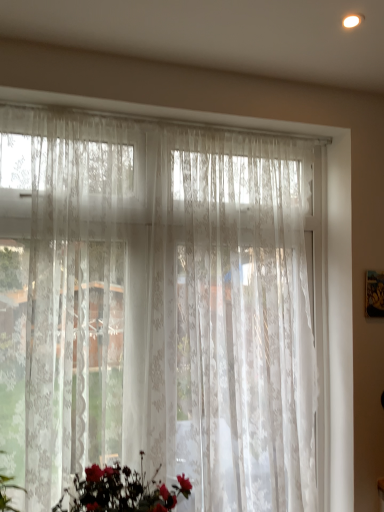
Question: From the image's perspective, is translucent floral-patterned curtain at center above or below silky white bouquet at lower center?

Choices:
 (A) below
 (B) above

Answer: (B)

Question: In terms of width, does translucent floral-patterned curtain at center look wider or thinner when compared to silky white bouquet at lower center?

Choices:
 (A) wide
 (B) thin

Answer: (B)

Question: Considering their positions, is translucent floral-patterned curtain at center located in front of or behind silky white bouquet at lower center?

Choices:
 (A) front
 (B) behind

Answer: (B)

Question: Would you say silky white bouquet at lower center is to the left or to the right of translucent floral-patterned curtain at center in the picture?

Choices:
 (A) left
 (B) right

Answer: (A)

Question: Based on their sizes in the image, would you say silky white bouquet at lower center is bigger or smaller than translucent floral-patterned curtain at center?

Choices:
 (A) big
 (B) small

Answer: (B)

Question: From the image's perspective, is silky white bouquet at lower center located above or below translucent floral-patterned curtain at center?

Choices:
 (A) above
 (B) below

Answer: (B)

Question: Relative to translucent floral-patterned curtain at center, is silky white bouquet at lower center in front or behind?

Choices:
 (A) front
 (B) behind

Answer: (A)